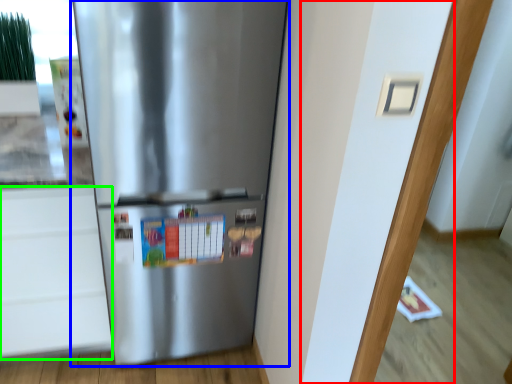
Question: Estimate the real-world distances between objects in this image. Which object is farther from door (highlighted by a red box), refrigerator (highlighted by a blue box) or drawer (highlighted by a green box)?

Choices:
 (A) refrigerator
 (B) drawer

Answer: (B)